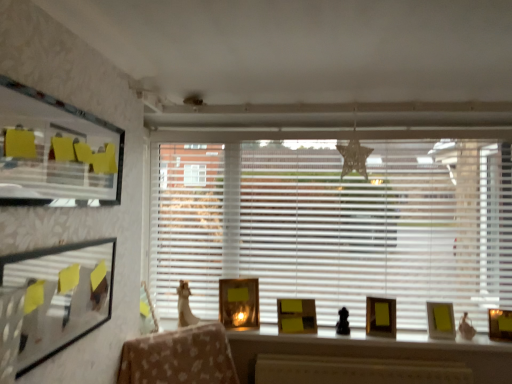
This screenshot has width=512, height=384. Find the location of `yellow matte picture frame at center, marked as the 5th picture frame in a front-to-back arrangement`. yellow matte picture frame at center, marked as the 5th picture frame in a front-to-back arrangement is located at coordinates (296, 316).

At what (x,y) coordinates should I click in order to perform the action: click on matte black picture frame at left, arranged as the first picture frame when viewed from the left. Please return your answer as a coordinate pair (x, y). Looking at the image, I should click on (61, 295).

This screenshot has width=512, height=384. What do you see at coordinates (441, 320) in the screenshot?
I see `matte gold picture frame at right, placed as the third picture frame when sorted from back to front` at bounding box center [441, 320].

This screenshot has height=384, width=512. What do you see at coordinates (239, 303) in the screenshot?
I see `gold metallic picture frame at center, which is counted as the second picture frame, starting from the left` at bounding box center [239, 303].

In order to face white plastic blinds at center, should I rotate leftwards or rightwards?

Rotate right and turn 9.270 degrees.

This screenshot has width=512, height=384. In order to click on yellow matte picture frame at center, the 4th picture frame positioned from the right in this screenshot , I will do `click(296, 316)`.

From a real-world perspective, is matte gold picture frame at right, positioned as the 4th picture frame in front-to-back order, above or below matte gold picture frame at right, the first picture frame from the right?

matte gold picture frame at right, positioned as the 4th picture frame in front-to-back order, is above matte gold picture frame at right, the first picture frame from the right.

Between matte gold picture frame at right, placed as the third picture frame when sorted from back to front, and matte gold picture frame at right, the first picture frame from the right, which one has larger size?

matte gold picture frame at right, placed as the third picture frame when sorted from back to front.

From their relative heights in the image, would you say matte gold picture frame at right, placed as the third picture frame when sorted from back to front, is taller or shorter than matte gold picture frame at right, the first picture frame from the right?

Clearly, matte gold picture frame at right, placed as the third picture frame when sorted from back to front, is taller compared to matte gold picture frame at right, the first picture frame from the right.

Is matte gold picture frame at right, placed as the third picture frame when sorted from back to front, wider than matte gold picture frame at right, arranged as the second picture frame when viewed from the front?

Yes, matte gold picture frame at right, placed as the third picture frame when sorted from back to front, is wider than matte gold picture frame at right, arranged as the second picture frame when viewed from the front.

Does gold metallic picture frame at center, which ranks as the fifth picture frame in right-to-left order, come behind matte gold picture frame at right, the first picture frame from the right?

Yes, it is.

From the image's perspective, is gold metallic picture frame at center, which is counted as the second picture frame, starting from the left, located above matte gold picture frame at right, the first picture frame from the right?

Yes, from the image's perspective, gold metallic picture frame at center, which is counted as the second picture frame, starting from the left, is on top of matte gold picture frame at right, the first picture frame from the right.

From a real-world perspective, is gold metallic picture frame at center, arranged as the 6th picture frame when viewed from the front, physically above matte gold picture frame at right, arranged as the second picture frame when viewed from the front?

Yes, from a real-world perspective, gold metallic picture frame at center, arranged as the 6th picture frame when viewed from the front, is over matte gold picture frame at right, arranged as the second picture frame when viewed from the front

How distant is white plastic blinds at center from matte gold picture frame at right, placed as the third picture frame when sorted from back to front?

A distance of 30.06 inches exists between white plastic blinds at center and matte gold picture frame at right, placed as the third picture frame when sorted from back to front.

Does white plastic blinds at center have a greater height compared to matte gold picture frame at right, the second picture frame viewed from the right?

Correct, white plastic blinds at center is much taller as matte gold picture frame at right, the second picture frame viewed from the right.

Is white plastic blinds at center next to matte gold picture frame at right, the fifth picture frame when ordered from left to right?

white plastic blinds at center and matte gold picture frame at right, the fifth picture frame when ordered from left to right, are not in contact.

How many degrees apart are the facing directions of white plastic blinds at center and matte gold picture frame at right, the second picture frame viewed from the right?

2.19 degrees.

Who is taller, matte gold picture frame at right, placed as the third picture frame when sorted from back to front, or gold metallic picture frame at center, which is counted as the second picture frame, starting from the left?

gold metallic picture frame at center, which is counted as the second picture frame, starting from the left.

Is matte gold picture frame at right, positioned as the 4th picture frame in front-to-back order, aimed at gold metallic picture frame at center, arranged as the 6th picture frame when viewed from the front?

No.

Is point (442, 322) positioned before point (238, 323)?

That is True.

From a real-world perspective, is matte gold picture frame at right, the second picture frame viewed from the right, above or below gold metallic picture frame at center, arranged as the 6th picture frame when viewed from the front?

matte gold picture frame at right, the second picture frame viewed from the right, is below gold metallic picture frame at center, arranged as the 6th picture frame when viewed from the front.

Between matte gold picture frame at right, the sixth picture frame viewed from the left, and white plastic blinds at center, which one appears on the right side from the viewer's perspective?

matte gold picture frame at right, the sixth picture frame viewed from the left.

You are a GUI agent. You are given a task and a screenshot of the screen. Output one action in this format:
    pyautogui.click(x=<x>, y=<y>)
    Task: Click on the 4th picture frame in front of the white plastic blinds at center, starting your count from the anchor
    Image resolution: width=512 pixels, height=384 pixels.
    Given the screenshot: What is the action you would take?
    pyautogui.click(x=500, y=324)

Can you confirm if matte gold picture frame at right, placed as the 5th picture frame when sorted from back to front, is taller than white plastic blinds at center?

In fact, matte gold picture frame at right, placed as the 5th picture frame when sorted from back to front, may be shorter than white plastic blinds at center.

Do you think wooden desk at center is within matte gold picture frame at right, placed as the 5th picture frame when sorted from back to front, or outside of it?

wooden desk at center exists outside the volume of matte gold picture frame at right, placed as the 5th picture frame when sorted from back to front.

Considering the sizes of wooden desk at center and matte gold picture frame at right, arranged as the second picture frame when viewed from the front, in the image, is wooden desk at center taller or shorter than matte gold picture frame at right, arranged as the second picture frame when viewed from the front,?

Clearly, wooden desk at center is taller compared to matte gold picture frame at right, arranged as the second picture frame when viewed from the front.

Between wooden desk at center and matte gold picture frame at right, the sixth picture frame viewed from the left, which one has smaller width?

matte gold picture frame at right, the sixth picture frame viewed from the left.

Is wooden desk at center directly adjacent to matte gold picture frame at right, the first picture frame from the right?

No, wooden desk at center is not making contact with matte gold picture frame at right, the first picture frame from the right.

Where is `window blind below the yellow sticky notes at upper left (from the image's perspective)`? The image size is (512, 384). window blind below the yellow sticky notes at upper left (from the image's perspective) is located at coordinates (335, 225).

Is white plastic blinds at center completely or partially outside of yellow sticky notes at upper left?

Absolutely, white plastic blinds at center is external to yellow sticky notes at upper left.

From a real-world perspective, is white plastic blinds at center above or below yellow sticky notes at upper left?

In terms of real-world spatial position, white plastic blinds at center is below yellow sticky notes at upper left.

Between white plastic blinds at center and yellow sticky notes at upper left, which one is positioned behind?

white plastic blinds at center.

The width and height of the screenshot is (512, 384). Identify the location of picture frame located below the matte gold picture frame at right, the second picture frame viewed from the right (from the image's perspective). (500, 324).

Where is `the 4th picture frame counting from the left side of the matte gold picture frame at right, arranged as the second picture frame when viewed from the front`? The width and height of the screenshot is (512, 384). the 4th picture frame counting from the left side of the matte gold picture frame at right, arranged as the second picture frame when viewed from the front is located at coordinates (239, 303).

Considering their positions, is matte gold picture frame at right, the sixth picture frame viewed from the left, positioned closer to wooden desk at center than gold metallic picture frame at center, arranged as the 1th picture frame when viewed from the back?

The object closer to wooden desk at center is gold metallic picture frame at center, arranged as the 1th picture frame when viewed from the back.

From the image, which object appears to be farther from white plastic blinds at center, yellow matte picture frame at center, placed as the 3th picture frame when sorted from left to right, or gold metallic picture frame at center, which ranks as the fifth picture frame in right-to-left order?

Based on the image, yellow matte picture frame at center, placed as the 3th picture frame when sorted from left to right, appears to be further to white plastic blinds at center.

From the picture: Estimate the real-world distances between objects in this image. Which object is closer to yellow sticky notes at upper left, white plastic blinds at center or matte gold picture frame at right, the fifth picture frame when ordered from left to right?

Based on the image, white plastic blinds at center appears to be nearer to yellow sticky notes at upper left.

From the picture: From the image, which object appears to be nearer to white plastic blinds at center, wooden desk at center or matte gold picture frame at right, arranged as the second picture frame when viewed from the front?

wooden desk at center.

Looking at the image, which one is located closer to white plastic blinds at center, matte gold picture frame at right, placed as the third picture frame when sorted from back to front, or matte gold picture frame at right, placed as the 5th picture frame when sorted from back to front?

Among the two, matte gold picture frame at right, placed as the third picture frame when sorted from back to front, is located nearer to white plastic blinds at center.

Based on their spatial positions, is matte gold picture frame at right, positioned as the 4th picture frame in front-to-back order, or matte black picture frame at left, arranged as the first picture frame when viewed from the left, closer to gold metallic picture frame at center, arranged as the 6th picture frame when viewed from the front?

Based on the image, matte gold picture frame at right, positioned as the 4th picture frame in front-to-back order, appears to be nearer to gold metallic picture frame at center, arranged as the 6th picture frame when viewed from the front.

Considering their positions, is yellow sticky notes at upper left positioned closer to gold metallic picture frame at center, which is counted as the second picture frame, starting from the left, than matte gold picture frame at center, which is the fourth picture frame in left-to-right order?

matte gold picture frame at center, which is the fourth picture frame in left-to-right order, lies closer to gold metallic picture frame at center, which is counted as the second picture frame, starting from the left, than the other object.

Which object lies further to the anchor point yellow matte picture frame at center, the 4th picture frame positioned from the right, wooden desk at center or matte black picture frame at left, which ranks as the 6th picture frame in back-to-front order?

The object further to yellow matte picture frame at center, the 4th picture frame positioned from the right, is matte black picture frame at left, which ranks as the 6th picture frame in back-to-front order.

Identify the location of picture frame between gold metallic picture frame at center, arranged as the 1th picture frame when viewed from the back, and matte gold picture frame at center, acting as the 3th picture frame starting from the front. The height and width of the screenshot is (384, 512). (296, 316).

Locate an element on the screen. computer desk between matte black picture frame at left, the first picture frame when ordered from front to back, and yellow matte picture frame at center, placed as the 3th picture frame when sorted from left to right, from front to back is located at coordinates (378, 358).

Identify the location of window blind between matte black picture frame at left, arranged as the first picture frame when viewed from the left, and gold metallic picture frame at center, arranged as the 6th picture frame when viewed from the front, along the z-axis. The height and width of the screenshot is (384, 512). (335, 225).

Where is `computer desk between matte black picture frame at left, which ranks as the 6th picture frame in back-to-front order, and white plastic blinds at center in the front-back direction`? computer desk between matte black picture frame at left, which ranks as the 6th picture frame in back-to-front order, and white plastic blinds at center in the front-back direction is located at coordinates (378, 358).